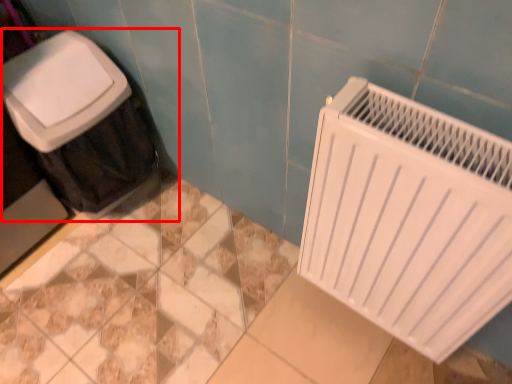
Question: From the image's perspective, what is the correct spatial positioning of waste container (annotated by the red box) in reference to radiator?

Choices:
 (A) below
 (B) above

Answer: (B)